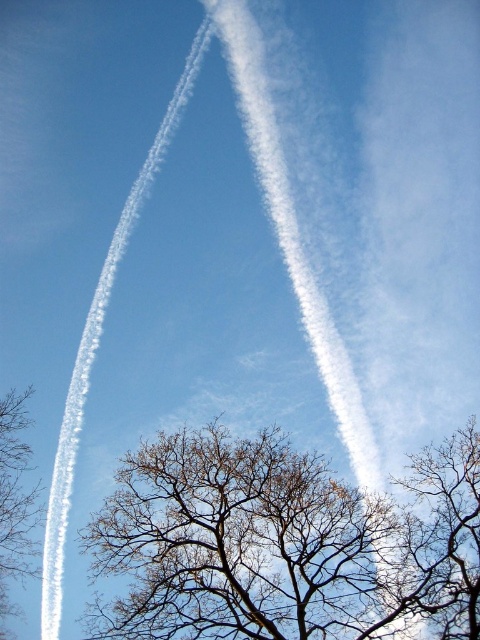
Does bare branches at center appear under brown leafless branches at left?

Actually, bare branches at center is above brown leafless branches at left.

Is bare branches at center to the left of brown leafless branches at left from the viewer's perspective?

No, bare branches at center is not to the left of brown leafless branches at left.

Which is in front, point (288, 525) or point (22, 403)?

Point (288, 525) is in front.

Where is `bare branches at center`? Image resolution: width=480 pixels, height=640 pixels. bare branches at center is located at coordinates (285, 544).

Does brown leafless branches at center appear on the right side of brown leafless branches at left?

Correct, you'll find brown leafless branches at center to the right of brown leafless branches at left.

Is point (436, 541) more distant than point (12, 472)?

No, (436, 541) is closer to viewer.

Between point (428, 589) and point (17, 497), which one is positioned behind?

Positioned behind is point (17, 497).

Locate an element on the screen. brown leafless branches at center is located at coordinates (444, 536).

Does point (397, 512) come behind point (472, 586)?

Yes, it is behind point (472, 586).

Is bare branches at center shorter than brown leafless branches at center?

In fact, bare branches at center may be taller than brown leafless branches at center.

Identify the location of bare branches at center. Image resolution: width=480 pixels, height=640 pixels. (285, 544).